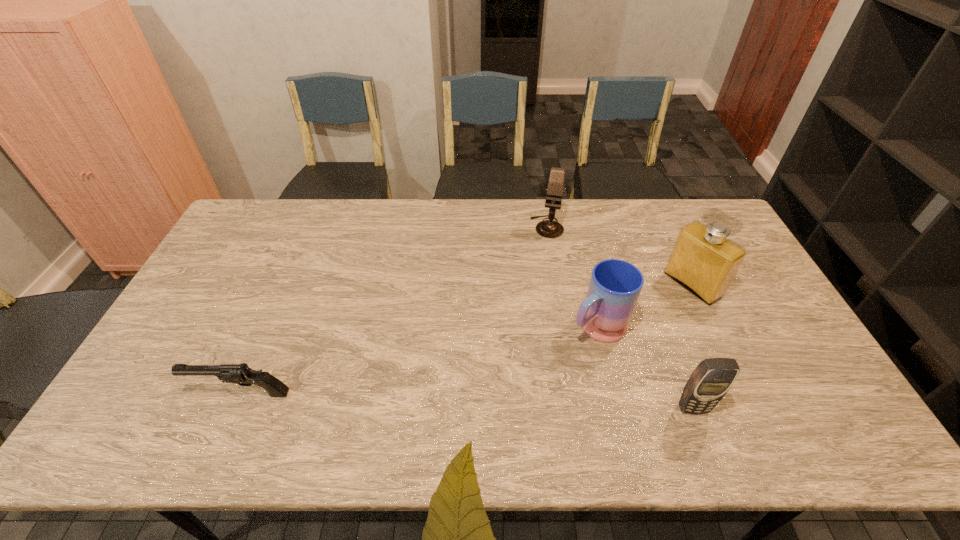
At what (x,y) coordinates should I click in order to perform the action: click on free space at the near left corner of the desktop. Please return your answer as a coordinate pair (x, y). Looking at the image, I should click on (168, 393).

At what (x,y) coordinates should I click in order to perform the action: click on vacant region at the far right corner of the desktop. Please return your answer as a coordinate pair (x, y). The height and width of the screenshot is (540, 960). Looking at the image, I should click on (682, 214).

Identify the location of vacant area between the third nearest object and the rightmost object. Image resolution: width=960 pixels, height=540 pixels. click(644, 306).

In order to click on vacant area that lies between the cellular telephone and the mug in this screenshot , I will do `click(645, 368)`.

Identify the location of empty location between the nearest object and the perfume. (692, 347).

I want to click on free space between the leftmost object and the second farthest object, so click(x=467, y=339).

Identify the location of free point between the perfume and the mug. (644, 306).

Locate an element on the screen. free space between the third nearest object and the cellular telephone is located at coordinates point(645,368).

Where is `free area in between the gun and the microphone`? free area in between the gun and the microphone is located at coordinates (395, 310).

Find the location of a particular element. This screenshot has height=540, width=960. vacant space that's between the fourth nearest object and the third farthest object is located at coordinates click(644, 306).